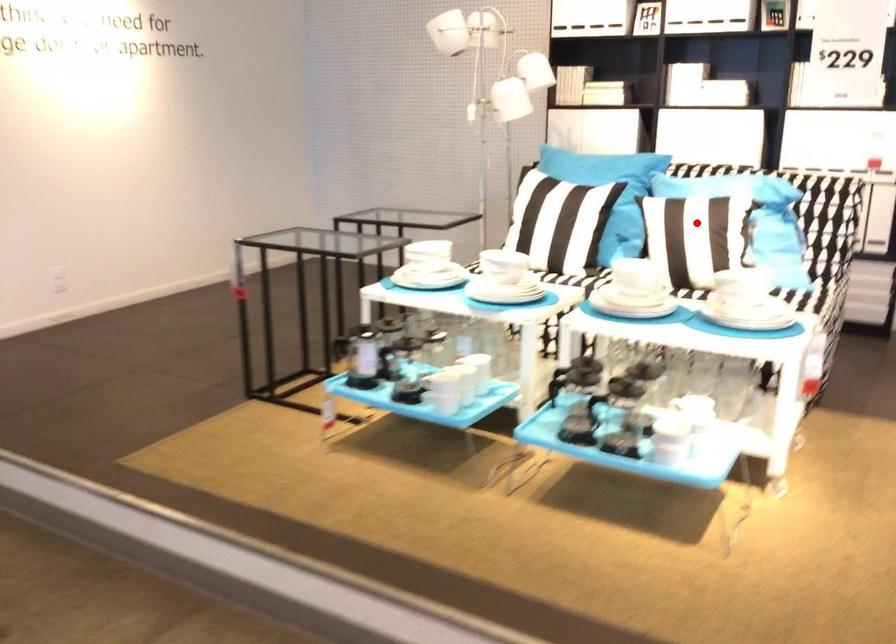
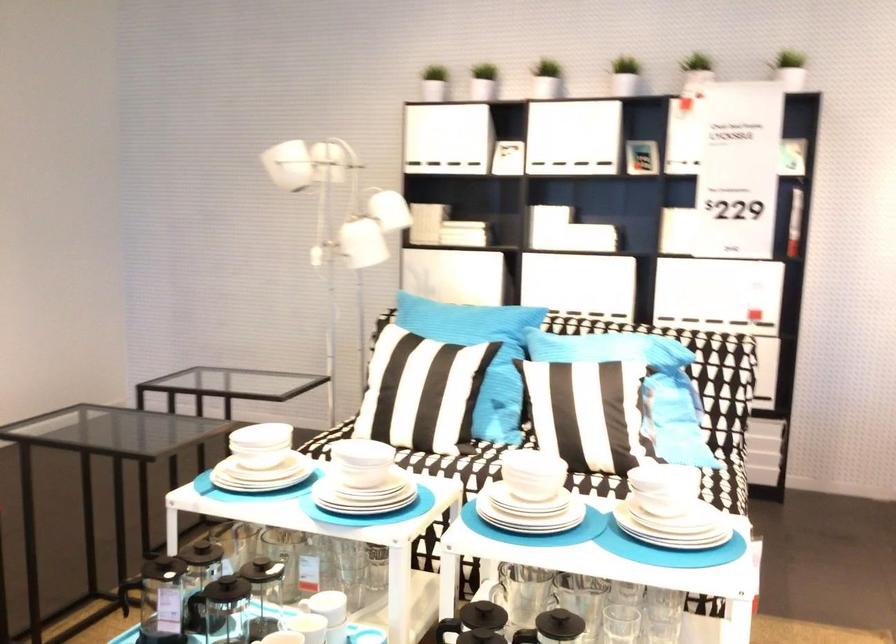
Locate, in the second image, the point that corresponds to the highlighted location in the first image.

(583, 404)